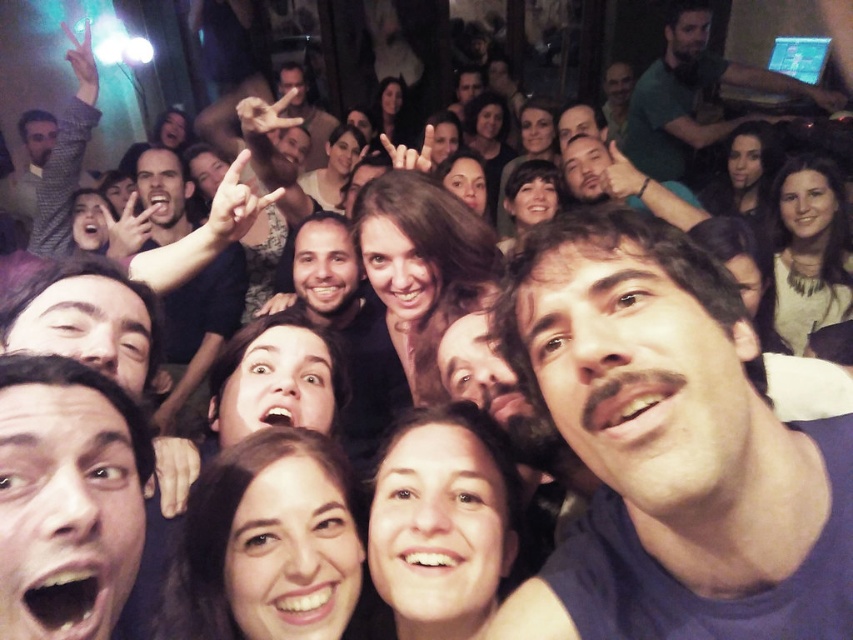
You are at a party and want to take a photo with two friends wearing the dark blue fabric at center and the green matte shirt at upper right. To ensure both friends are in the frame, should you move your phone to the left or right?

The dark blue fabric at center is positioned on the left side of green matte shirt at upper right, so you should move your phone to the right to include both friends in the frame.

In the group selfie, where is the dark blue fabric at center located in terms of its 2D coordinates?

The dark blue fabric at center is located at the 2D coordinates point [670,448].

You are a photographer who wants to ensure that every face in the group selfie is clearly visible. The smooth skin face at lower left is at position 0.778, 0.080. Is this face positioned within the central 50x50 pixel area of the image?

The smooth skin face at lower left is located at point (67,497), which is outside the central 50x50 pixel area of the image. Therefore, it may not be as prominently displayed as those in the center.